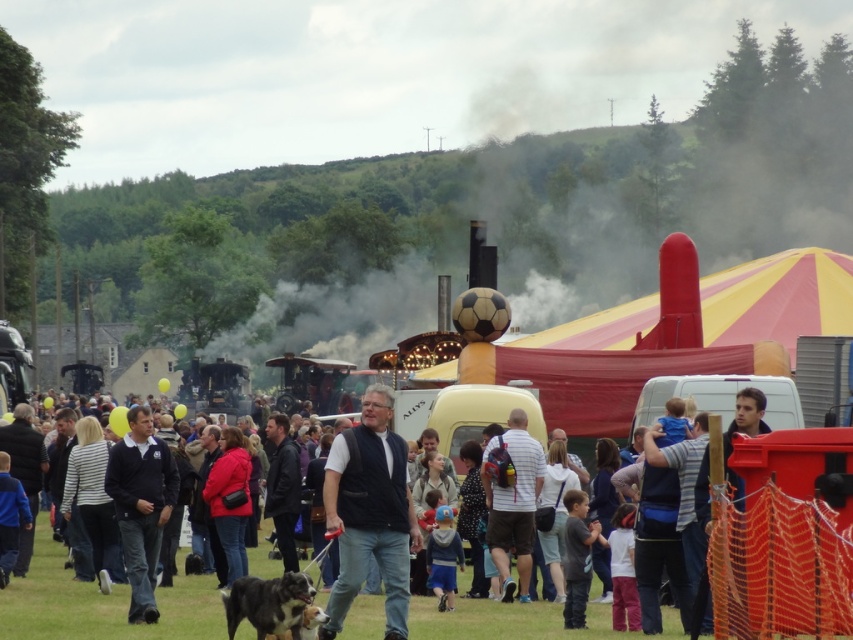
Question: Which point is closer to the camera?

Choices:
 (A) (309, 580)
 (B) (489, 470)
 (C) (372, 513)

Answer: (A)

Question: Among these objects, which one is nearest to the camera?

Choices:
 (A) dark blue jacket at center
 (B) dark blue jeans at center

Answer: (B)

Question: Where is metallic steam at center located in relation to dark blue jeans at center in the image?

Choices:
 (A) below
 (B) above

Answer: (B)

Question: Is metallic steam at center behind dark blue jacket at center?

Choices:
 (A) yes
 (B) no

Answer: (A)

Question: From the image, what is the correct spatial relationship of dark blue jacket at center in relation to black and white fur dog at lower left?

Choices:
 (A) below
 (B) above

Answer: (B)

Question: Which of these objects is positioned farthest from the matte black vest at center?

Choices:
 (A) dark blue jacket at center
 (B) dark blue jeans at center
 (C) metallic steam at center

Answer: (C)